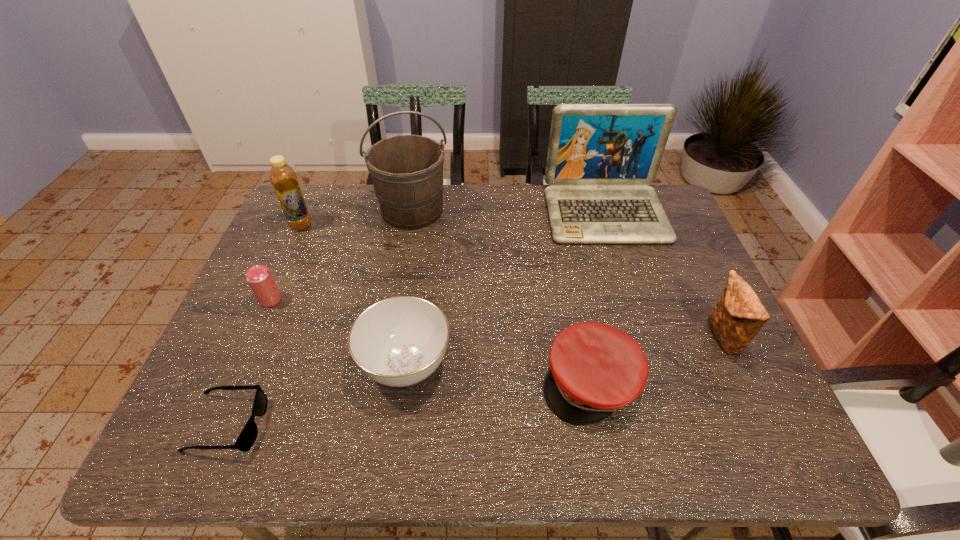
At what (x,y) coordinates should I click in order to perform the action: click on vacant region between the cap and the sunglasses. Please return your answer as a coordinate pair (x, y). Looking at the image, I should click on (409, 403).

Locate an element on the screen. The image size is (960, 540). vacant space in between the chinaware and the bottle is located at coordinates (353, 295).

What are the coordinates of `empty space that is in between the sunglasses and the bucket` in the screenshot? It's located at (320, 318).

This screenshot has width=960, height=540. Identify the location of free space between the third tallest object and the cap. (445, 304).

You are a GUI agent. You are given a task and a screenshot of the screen. Output one action in this format:
    pyautogui.click(x=<x>, y=<y>)
    Task: Click on the free space between the chinaware and the shortest object
    
    Given the screenshot: What is the action you would take?
    pyautogui.click(x=317, y=395)

Where is `empty location between the clutch bag and the bottle`? empty location between the clutch bag and the bottle is located at coordinates (512, 281).

Identify which object is the fifth closest to the second tallest object. Please provide its 2D coordinates. Your answer should be formatted as a tuple, i.e. [(x, y)], where the tuple contains the x and y coordinates of a point satisfying the conditions above.

[(283, 177)]

Identify the location of object that stands as the closest to the bottle. The width and height of the screenshot is (960, 540). (407, 170).

Find the location of a particular element. The width and height of the screenshot is (960, 540). free location that satisfies the following two spatial constraints: 1. on the back side of the bucket; 2. on the right side of the bottle is located at coordinates (307, 211).

At what (x,y) coordinates should I click in order to perform the action: click on vacant space that satisfies the following two spatial constraints: 1. on the open side of the fourth tallest object; 2. at the front of the cap where the visor is located. Please return your answer as a coordinate pair (x, y). This screenshot has width=960, height=540. Looking at the image, I should click on point(744,382).